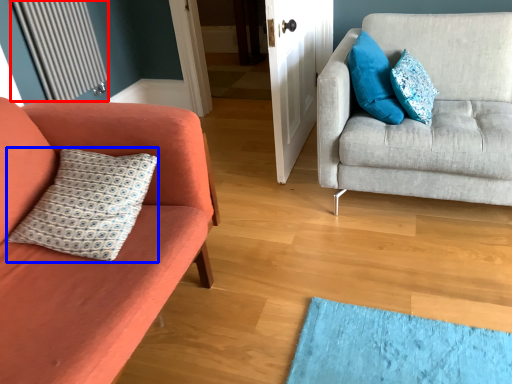
Question: Among these objects, which one is farthest to the camera, radiator (highlighted by a red box) or pillow (highlighted by a blue box)?

Choices:
 (A) radiator
 (B) pillow

Answer: (A)